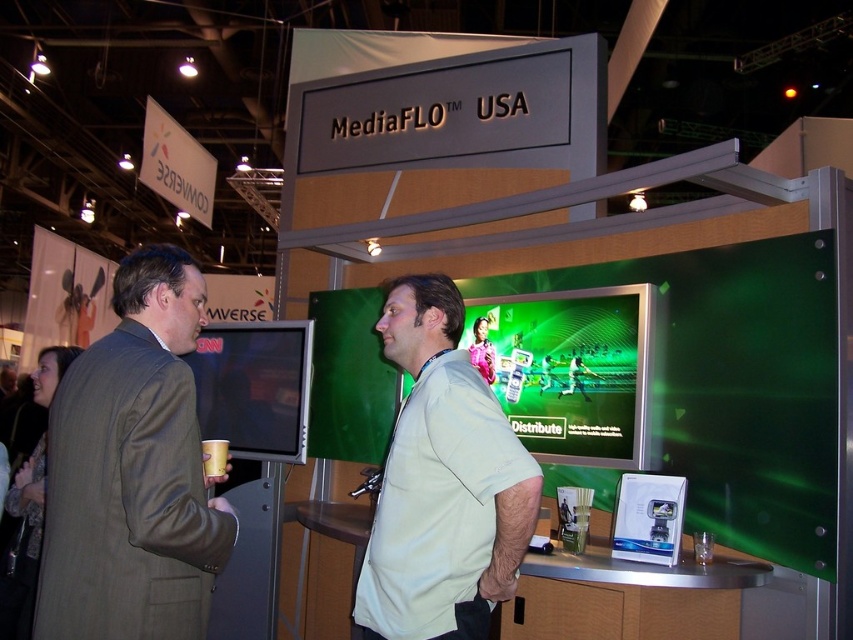
You are setting up a display at the MediaFLO USA booth and need to place a new stand that requires 1.2 meters of vertical space. Given the green glossy screen at center and the matte black monitor at center, which one can accommodate the stand based on their heights?

The green glossy screen at center is taller than the matte black monitor at center, so the stand requiring 1.2 meters of vertical space can be placed with the green glossy screen at center since it offers more height.

You are attending a trade show and need to locate the MediaFLO USA booth. You see the matte brown suit at left and the matte black monitor at center. Which object is positioned lower in the image?

The matte brown suit at left is located below the matte black monitor at center, so it is positioned lower in the image.